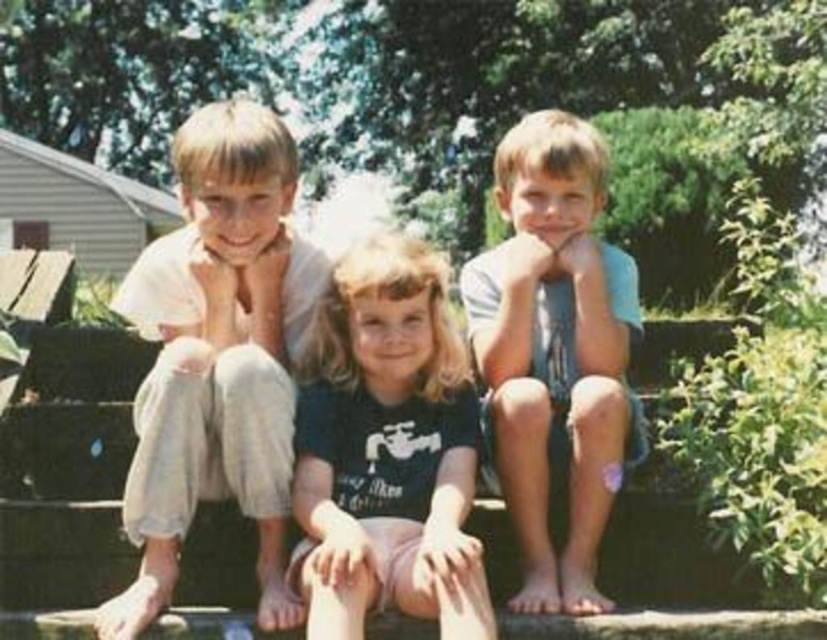
You are a photographer trying to capture a candid shot of the children. You notice the light beige cotton shirt at left and the light blue denim shorts at center. Which clothing item is positioned higher in the image?

The light beige cotton shirt at left is taller than the light blue denim shorts at center, so the light beige cotton shirt at left is positioned higher in the image.

You are standing 10 feet away from the black cotton shirt at center. Can you reach it without moving?

The black cotton shirt at center is 11.80 feet away from the viewer, which is farther than your current distance of 10 feet. Therefore, you cannot reach it without moving closer.